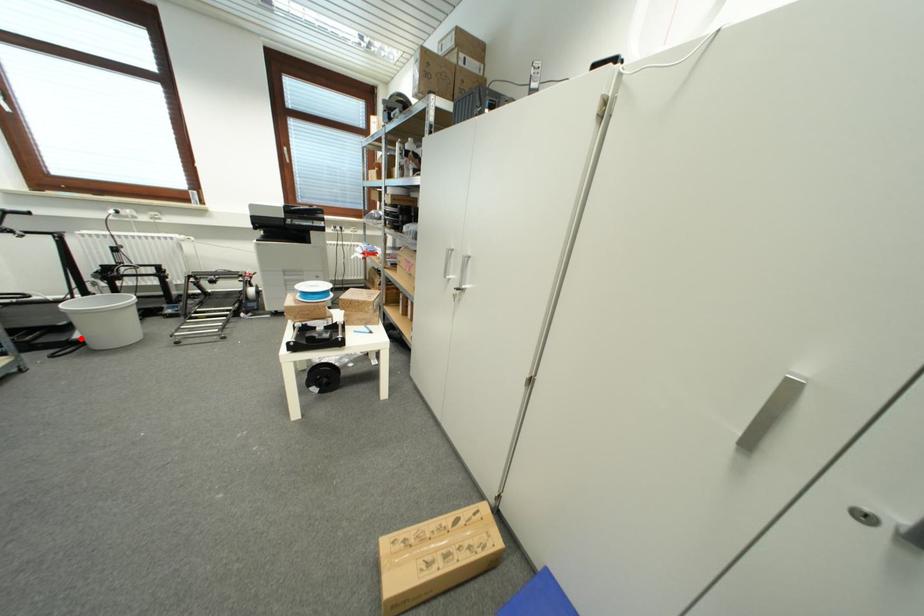
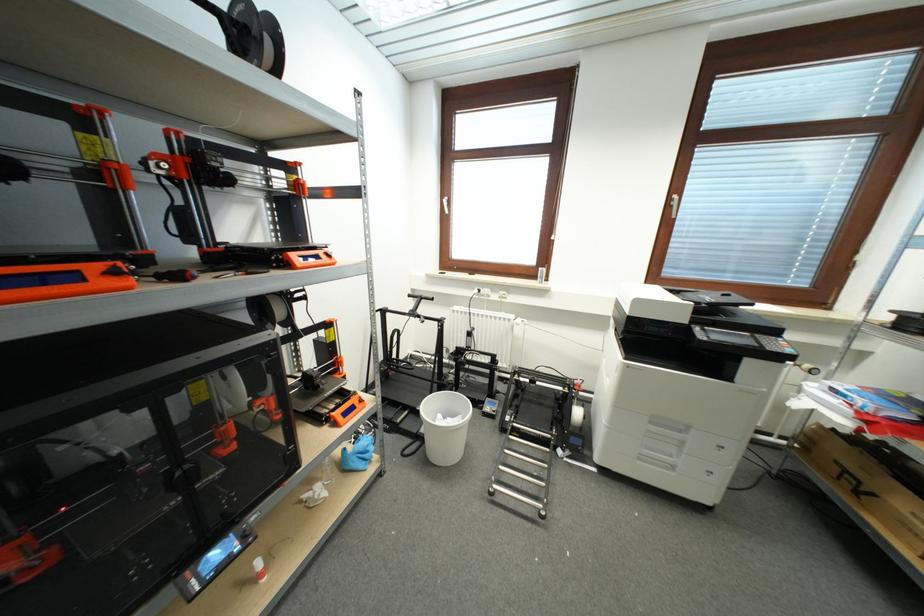
In the second image, find the point that corresponds to the highlighted location in the first image.

(427, 434)